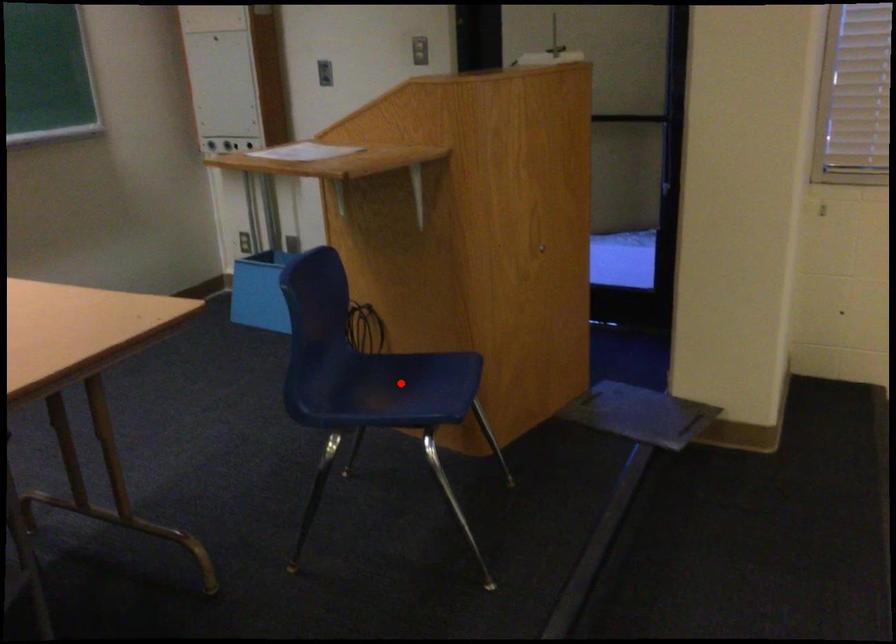
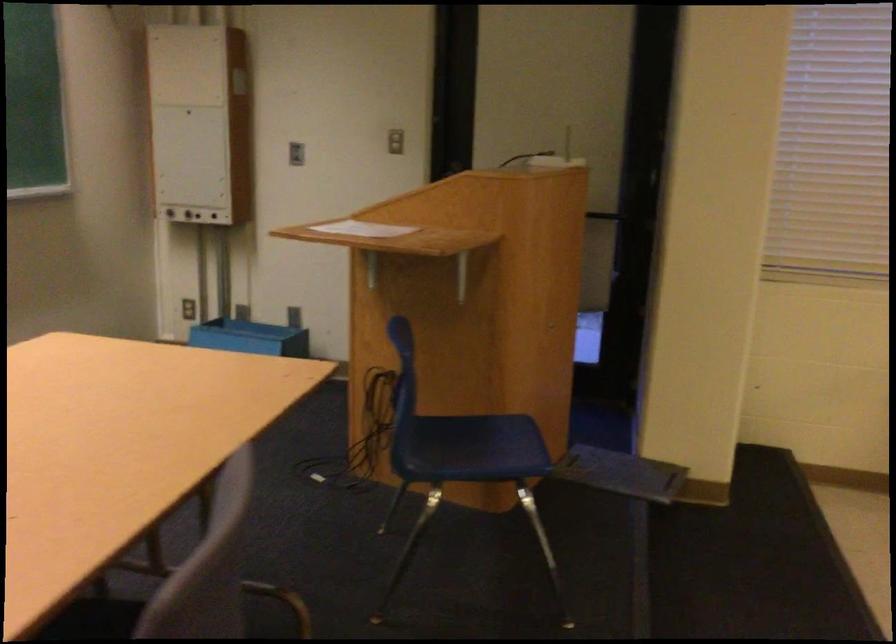
Find the pixel in the second image that matches the highlighted location in the first image.

(466, 442)